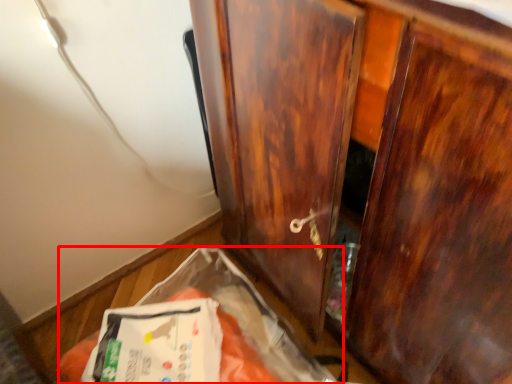
Question: From the image's perspective, considering the relative positions of waste (annotated by the red box) and cupboard in the image provided, where is waste (annotated by the red box) located with respect to the staircase?

Choices:
 (A) below
 (B) above

Answer: (A)